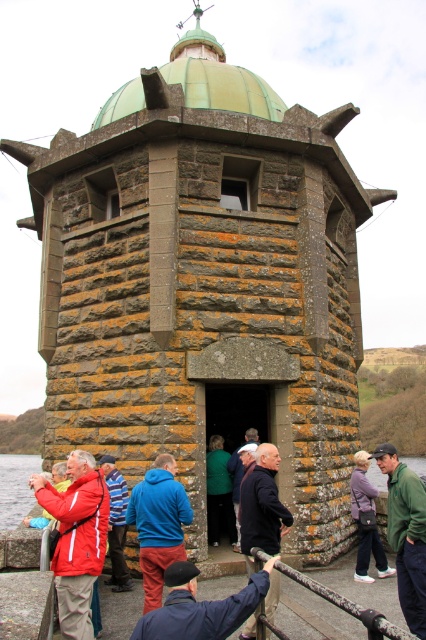
Question: Is green matte jacket at lower right closer to the viewer compared to dark blue fabric at center?

Choices:
 (A) yes
 (B) no

Answer: (A)

Question: Which of these objects is positioned closest to the dark blue fabric at center?

Choices:
 (A) red jacket at center
 (B) blue fabric jacket at center
 (C) blue fleece jacket at center

Answer: (C)

Question: Is red jacket at center wider than green matte jacket at lower right?

Choices:
 (A) yes
 (B) no

Answer: (A)

Question: Among these points, which one is nearest to the camera?

Choices:
 (A) (377, 445)
 (B) (86, 586)

Answer: (B)

Question: Which is nearer to the red jacket at left?

Choices:
 (A) green matte jacket at lower right
 (B) blue fabric jacket at center

Answer: (B)

Question: In this image, where is red jacket at center located relative to clear water at lower left?

Choices:
 (A) right
 (B) left

Answer: (A)